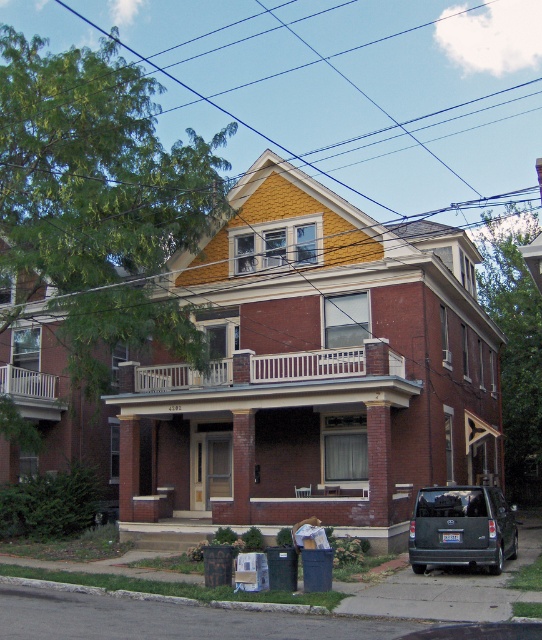
Question: Considering the relative positions of dark gray matte suv at lower right and white wooden balcony at lower left in the image provided, where is dark gray matte suv at lower right located with respect to white wooden balcony at lower left?

Choices:
 (A) left
 (B) right

Answer: (B)

Question: Among these points, which one is nearest to the camera?

Choices:
 (A) (442, 540)
 (B) (41, 408)

Answer: (A)

Question: Which point is closer to the camera?

Choices:
 (A) (506, 516)
 (B) (9, 365)

Answer: (A)

Question: Does dark gray matte suv at lower right come behind white wooden balcony at lower left?

Choices:
 (A) no
 (B) yes

Answer: (A)

Question: Does dark gray matte suv at lower right have a larger size compared to white wooden balcony at lower left?

Choices:
 (A) no
 (B) yes

Answer: (B)